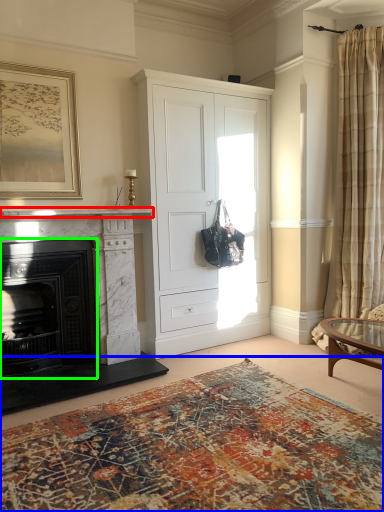
Question: Estimate the real-world distances between objects in this image. Which object is farther from mantle (highlighted by a red box), hardwood (highlighted by a blue box) or fireplace (highlighted by a green box)?

Choices:
 (A) hardwood
 (B) fireplace

Answer: (A)